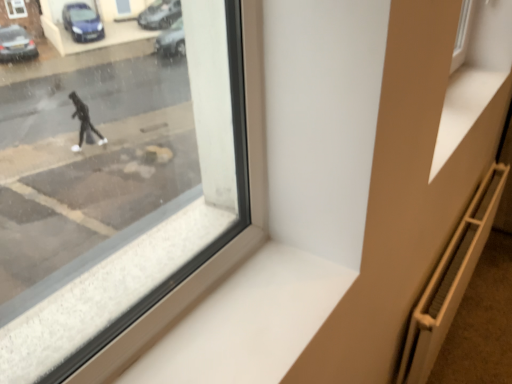
Question: Would you say brown textured radiator at lower right is a long distance from metallic radiator at lower right?

Choices:
 (A) yes
 (B) no

Answer: (B)

Question: Is brown textured radiator at lower right further to camera compared to metallic radiator at lower right?

Choices:
 (A) no
 (B) yes

Answer: (B)

Question: From the image's perspective, is brown textured radiator at lower right above metallic radiator at lower right?

Choices:
 (A) yes
 (B) no

Answer: (B)

Question: Considering the relative sizes of brown textured radiator at lower right and metallic radiator at lower right in the image provided, is brown textured radiator at lower right taller than metallic radiator at lower right?

Choices:
 (A) no
 (B) yes

Answer: (A)

Question: Can we say brown textured radiator at lower right lies outside metallic radiator at lower right?

Choices:
 (A) no
 (B) yes

Answer: (B)

Question: Considering the relative sizes of brown textured radiator at lower right and metallic radiator at lower right in the image provided, is brown textured radiator at lower right smaller than metallic radiator at lower right?

Choices:
 (A) no
 (B) yes

Answer: (B)

Question: Can you confirm if metallic radiator at lower right is bigger than white smooth window sill at lower center?

Choices:
 (A) no
 (B) yes

Answer: (B)

Question: Is metallic radiator at lower right to the left of white smooth window sill at lower center from the viewer's perspective?

Choices:
 (A) no
 (B) yes

Answer: (A)

Question: From a real-world perspective, does metallic radiator at lower right sit lower than white smooth window sill at lower center?

Choices:
 (A) no
 (B) yes

Answer: (B)

Question: Is metallic radiator at lower right to the right of white smooth window sill at lower center from the viewer's perspective?

Choices:
 (A) no
 (B) yes

Answer: (B)

Question: Is metallic radiator at lower right next to white smooth window sill at lower center?

Choices:
 (A) no
 (B) yes

Answer: (A)

Question: Could white smooth window sill at lower center be considered to be inside metallic radiator at lower right?

Choices:
 (A) yes
 (B) no

Answer: (B)

Question: Is metallic radiator at lower right to the right of brown textured radiator at lower right from the viewer's perspective?

Choices:
 (A) no
 (B) yes

Answer: (A)